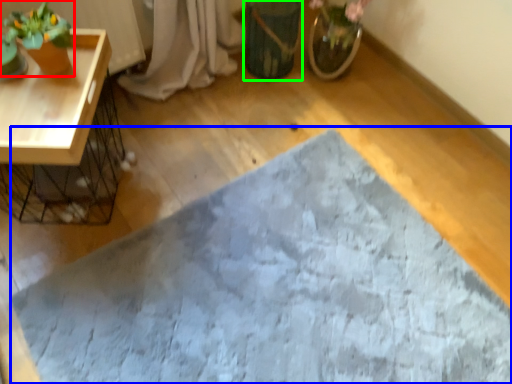
Question: Estimate the real-world distances between objects in this image. Which object is closer to houseplant (highlighted by a red box), bath mat (highlighted by a blue box) or flowerpot (highlighted by a green box)?

Choices:
 (A) bath mat
 (B) flowerpot

Answer: (B)